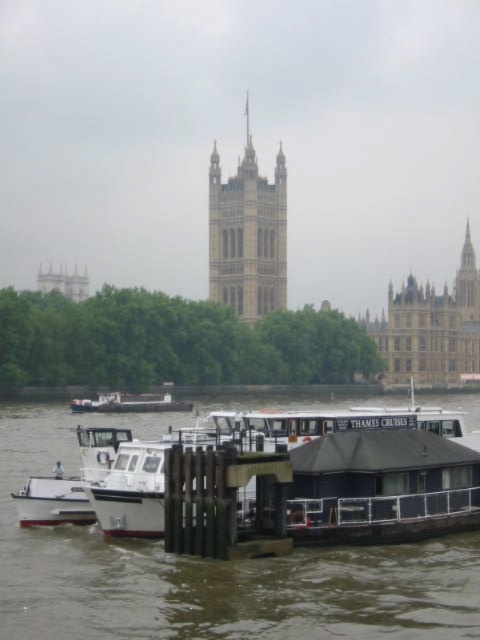
Question: Among these points, which one is nearest to the camera?

Choices:
 (A) (242, 180)
 (B) (97, 412)

Answer: (B)

Question: Which point is closer to the camera taking this photo?

Choices:
 (A) (412, 340)
 (B) (121, 397)
 (C) (241, 301)

Answer: (B)

Question: Can you confirm if stone tower at center is smaller than white matte boat at center?

Choices:
 (A) no
 (B) yes

Answer: (A)

Question: Does stone tower at center have a larger size compared to white matte boat at center?

Choices:
 (A) yes
 (B) no

Answer: (A)

Question: Estimate the real-world distances between objects in this image. Which object is closer to the white matte boat at center?

Choices:
 (A) brown stone building at center
 (B) stone tower at center
 (C) brown wooden dock at lower center

Answer: (C)

Question: Is brown wooden dock at lower center below brown stone building at center?

Choices:
 (A) no
 (B) yes

Answer: (B)